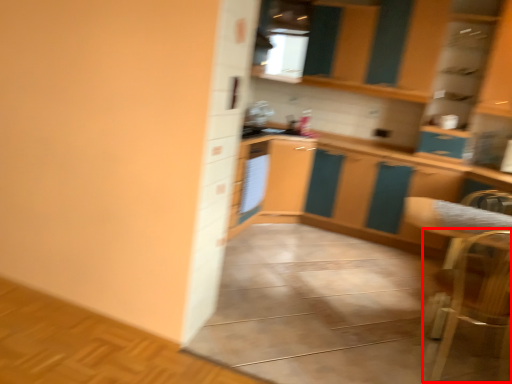
Question: Considering the relative positions of armchair (annotated by the red box) and appliance in the image provided, where is armchair (annotated by the red box) located with respect to the staircase?

Choices:
 (A) right
 (B) left

Answer: (A)